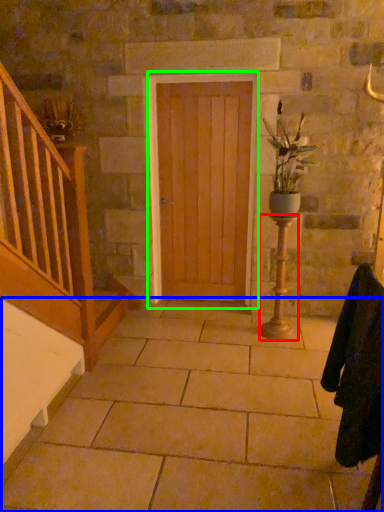
Question: Which object is the farthest from candle holder (highlighted by a red box)? Choose among these: concrete (highlighted by a blue box) or door (highlighted by a green box).

Choices:
 (A) concrete
 (B) door

Answer: (A)